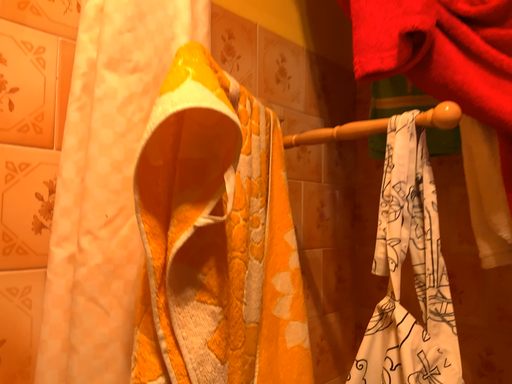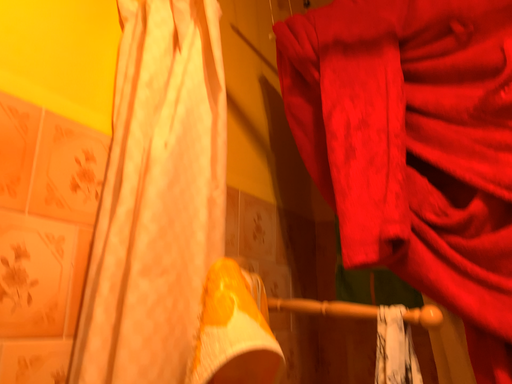
Question: How did the camera likely rotate when shooting the video?

Choices:
 (A) rotated right
 (B) rotated left

Answer: (A)